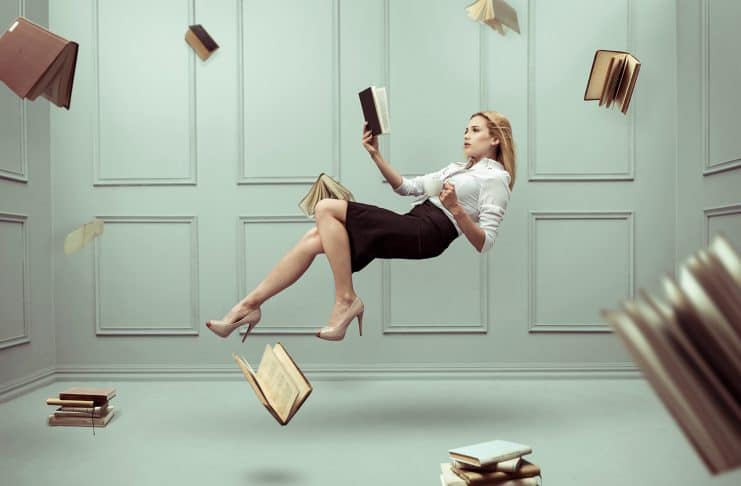
Locate an element on the screen. The width and height of the screenshot is (741, 486). stack of books is located at coordinates (78, 407).